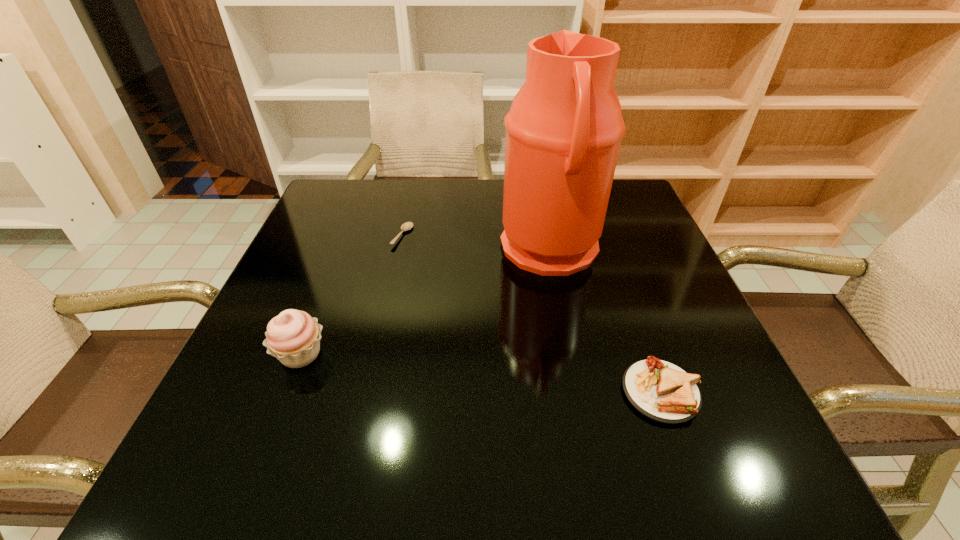
The image size is (960, 540). In order to click on water jug in this screenshot , I will do (x=563, y=132).

Find the location of `the leftmost object`. the leftmost object is located at coordinates (293, 337).

Identify the location of cupcake. The image size is (960, 540). (293, 337).

You are a GUI agent. You are given a task and a screenshot of the screen. Output one action in this format:
    pyautogui.click(x=<x>, y=<y>)
    Task: Click on the second shortest object
    
    Given the screenshot: What is the action you would take?
    pyautogui.click(x=660, y=390)

The width and height of the screenshot is (960, 540). I want to click on soupspoon, so click(x=406, y=226).

Locate an element on the screen. Image resolution: width=960 pixels, height=540 pixels. the shortest object is located at coordinates (406, 226).

This screenshot has height=540, width=960. What are the coordinates of `free point located 0.310m from the spout of the tallest object` in the screenshot? It's located at (369, 251).

Image resolution: width=960 pixels, height=540 pixels. In order to click on vacant position located 0.100m from the spout of the tallest object in this screenshot , I will do [458, 251].

Identify the location of free space located 0.160m from the spout of the tallest object. The width and height of the screenshot is (960, 540). (432, 251).

At what (x,y) coordinates should I click in order to perform the action: click on free space located on the right of the leftmost object. Please return your answer as a coordinate pair (x, y). The width and height of the screenshot is (960, 540). Looking at the image, I should click on (510, 354).